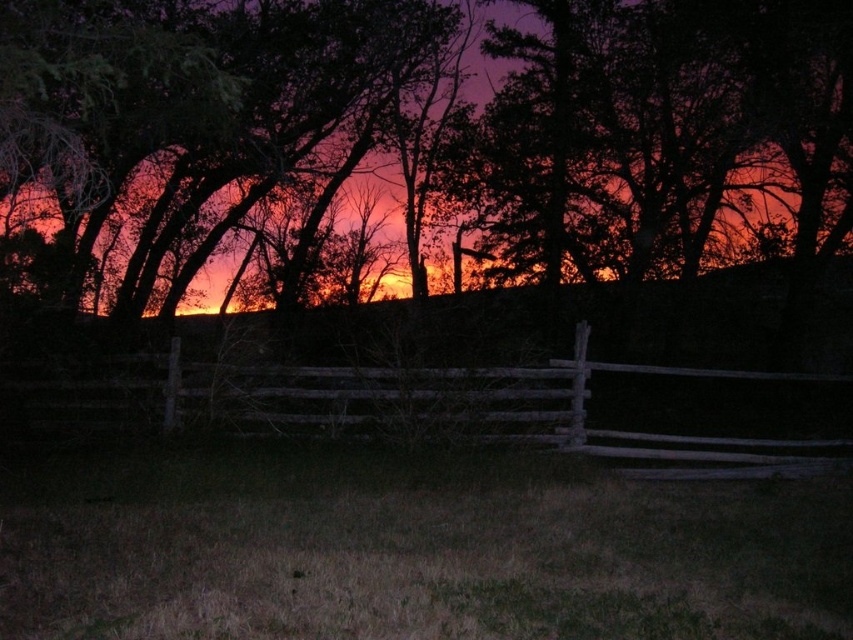
Which is above, dark brown wood fence at center or weathered wood fence at center?

Positioned higher is dark brown wood fence at center.

Does dark brown wood fence at center have a greater height compared to weathered wood fence at center?

Indeed, dark brown wood fence at center has a greater height compared to weathered wood fence at center.

Is point (236, 172) closer to camera compared to point (759, 444)?

No.

You are a GUI agent. You are given a task and a screenshot of the screen. Output one action in this format:
    pyautogui.click(x=<x>, y=<y>)
    Task: Click on the dark brown wood fence at center
    This screenshot has width=853, height=640.
    Given the screenshot: What is the action you would take?
    coord(434,129)